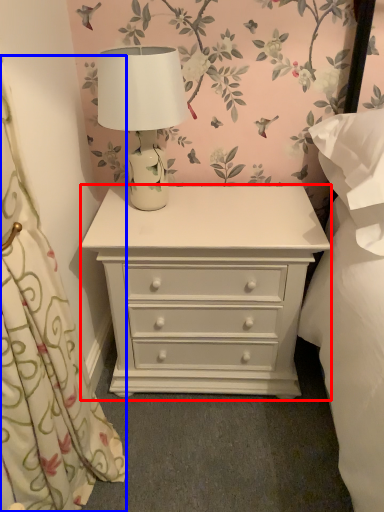
Question: Among these objects, which one is nearest to the camera, chest of drawers (highlighted by a red box) or curtain (highlighted by a blue box)?

Choices:
 (A) chest of drawers
 (B) curtain

Answer: (B)